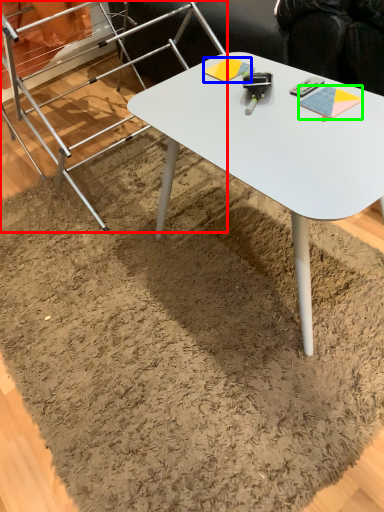
Question: Considering the real-world distances, which object is closest to ladder (highlighted by a red box)? notepad (highlighted by a blue box) or notepad (highlighted by a green box).

Choices:
 (A) notepad
 (B) notepad

Answer: (A)